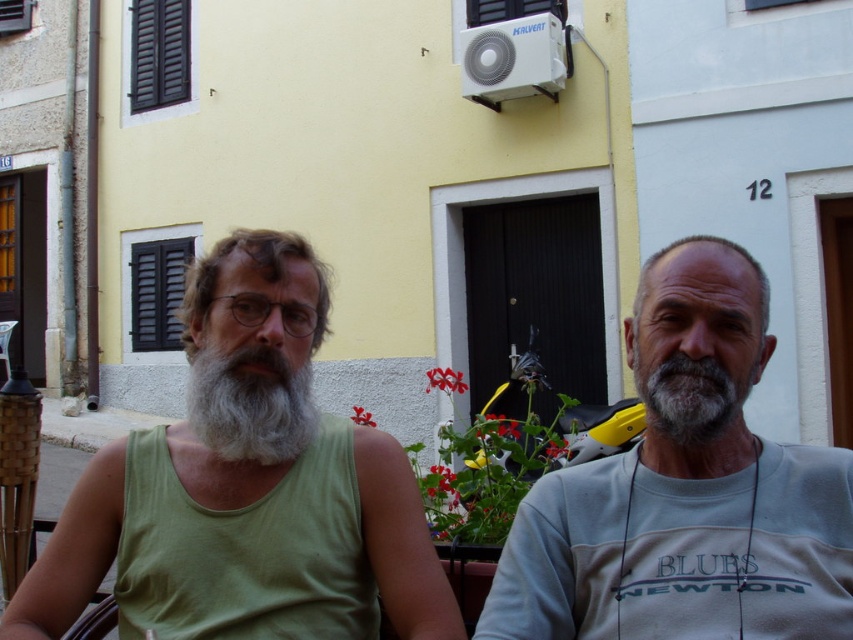
Question: Considering the real-world distances, which object is closest to the gray cotton t-shirt at center?

Choices:
 (A) gray cotton shirt at right
 (B) green fabric shirt at center
 (C) graywoollybeard at left

Answer: (A)

Question: Is gray cotton t-shirt at center closer to the viewer compared to green fabric shirt at center?

Choices:
 (A) no
 (B) yes

Answer: (B)

Question: Which object is farther from the camera taking this photo?

Choices:
 (A) graywoollybeard at left
 (B) gray cotton t-shirt at center
 (C) gray cotton shirt at right
 (D) green fabric shirt at center

Answer: (A)

Question: Among these objects, which one is nearest to the camera?

Choices:
 (A) gray cotton shirt at right
 (B) graywoollybeard at left

Answer: (A)

Question: Is gray cotton t-shirt at center thinner than green fabric shirt at center?

Choices:
 (A) no
 (B) yes

Answer: (B)

Question: Does green fabric shirt at center have a smaller size compared to graywoollybeard at left?

Choices:
 (A) yes
 (B) no

Answer: (B)